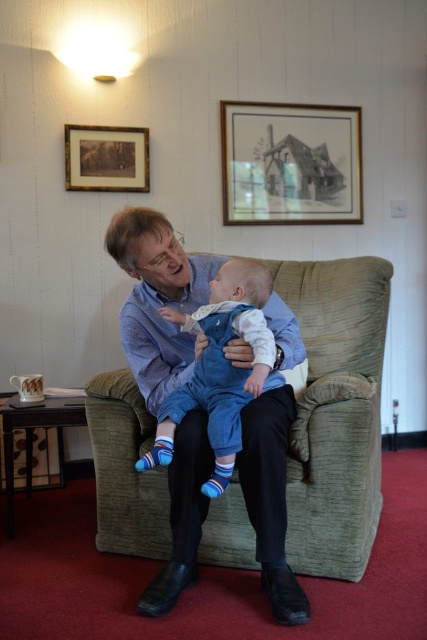
Question: Can you confirm if matte blue shirt at center is thinner than wooden picture frame at upper left?

Choices:
 (A) yes
 (B) no

Answer: (B)

Question: Which point is farther to the camera?

Choices:
 (A) black matte picture frame at upper center
 (B) blue denim overalls at center
 (C) matte blue shirt at center
 (D) wooden picture frame at upper left

Answer: (A)

Question: Is matte blue shirt at center positioned in front of black matte picture frame at upper center?

Choices:
 (A) no
 (B) yes

Answer: (B)

Question: Does black matte picture frame at upper center have a greater width compared to blue denim overalls at center?

Choices:
 (A) no
 (B) yes

Answer: (B)

Question: Which of the following is the farthest from the observer?

Choices:
 (A) blue denim overalls at center
 (B) black matte picture frame at upper center
 (C) matte blue shirt at center

Answer: (B)

Question: Which object appears closest to the camera in this image?

Choices:
 (A) blue denim overalls at center
 (B) black matte picture frame at upper center
 (C) wooden picture frame at upper left
 (D) matte blue shirt at center

Answer: (A)